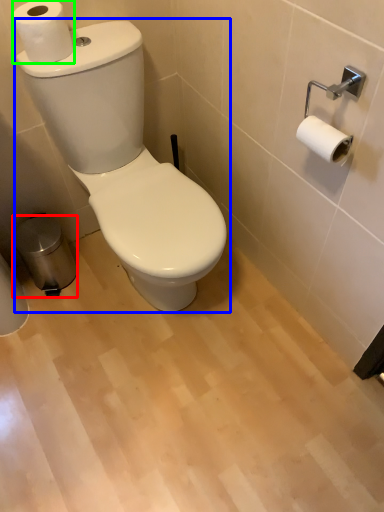
Question: Which is nearer to the trash bin/can (highlighted by a red box)? toilet (highlighted by a blue box) or toilet paper (highlighted by a green box).

Choices:
 (A) toilet
 (B) toilet paper

Answer: (A)